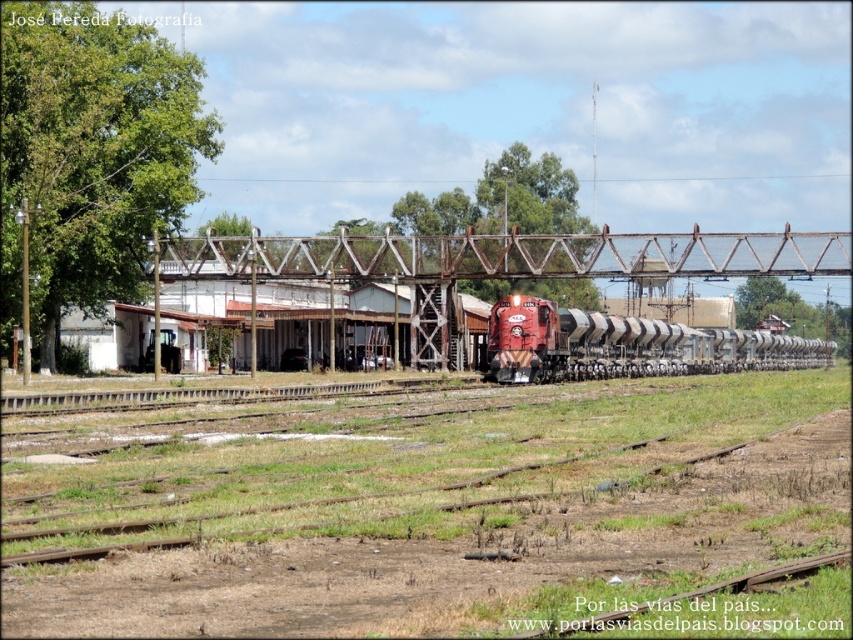
You are standing at the point closer to the camera between the two points, point (730,268) and point (509,307). Which point are you standing at?

You are standing at point (730,268) because it is further to the camera than point (509,307).

You are a train engineer who needs to safely pass the rusty metal bridge at center with your matte red locomotive at center. Based on the scene, can you confirm if the clearance under the bridge is sufficient for your locomotive to pass through?

The rusty metal bridge at center is taller than the matte red locomotive at center, so the clearance under the bridge is sufficient for the locomotive to pass through safely.

You are standing on the railway tracks and see the rusty metal bridge at center and the matte red locomotive at center. Which object is closer to you?

The rusty metal bridge at center is closer to you than the matte red locomotive at center because it is further to the viewer.